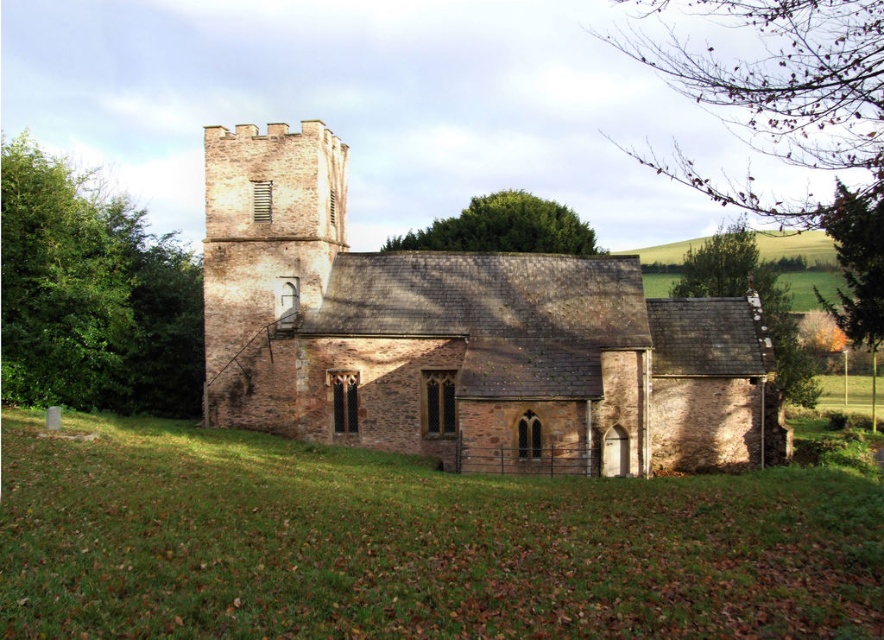
Question: Which of the following is the closest to the observer?

Choices:
 (A) green grass at lower center
 (B) green grassy hillside at upper right
 (C) green leafy tree at left
 (D) green leafy tree at upper center

Answer: (A)

Question: Which of the following is the closest to the observer?

Choices:
 (A) (380, 275)
 (B) (794, 577)
 (C) (101, 380)
 (D) (649, 257)

Answer: (B)

Question: Is green leafy tree at left smaller than green grassy hillside at upper right?

Choices:
 (A) no
 (B) yes

Answer: (A)

Question: Estimate the real-world distances between objects in this image. Which object is closer to the green grassy hillside at upper right?

Choices:
 (A) brown stone church at center
 (B) green grass at lower center

Answer: (A)

Question: Considering the relative positions of green leafy tree at left and green leafy tree at upper center in the image provided, where is green leafy tree at left located with respect to green leafy tree at upper center?

Choices:
 (A) left
 (B) right

Answer: (A)

Question: Can you confirm if green leafy tree at left is wider than brown stone tower at center-left?

Choices:
 (A) yes
 (B) no

Answer: (A)